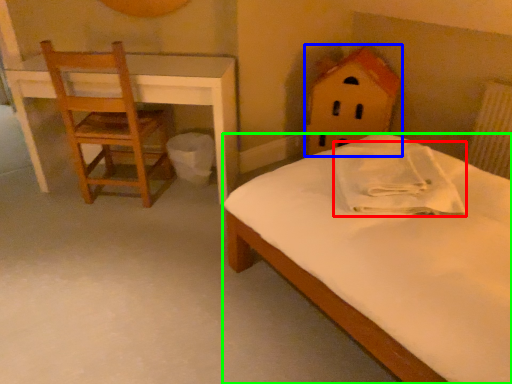
Question: Estimate the real-world distances between objects in this image. Which object is farther from pillow (highlighted by a red box), toy (highlighted by a blue box) or bed (highlighted by a green box)?

Choices:
 (A) toy
 (B) bed

Answer: (A)